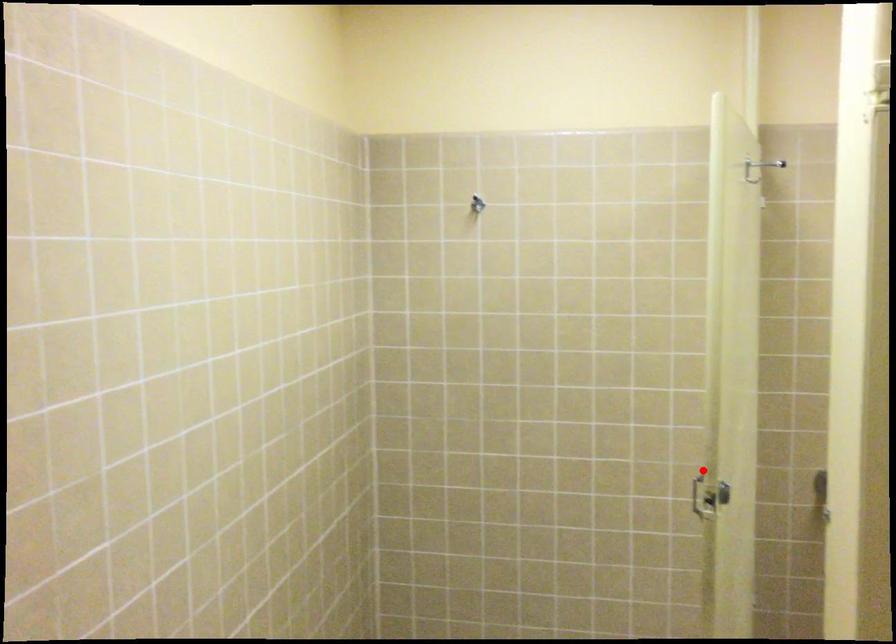
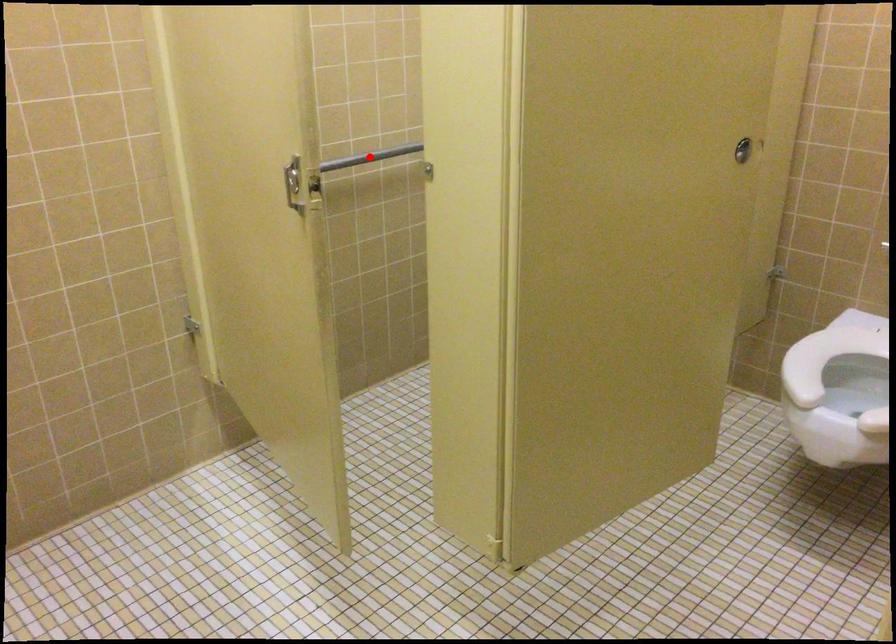
I am providing you with two images of the same scene from different viewpoints. A red point is marked on the first image and another point is marked on the second image. Are the points marked in image1 and image2 representing the same 3D position?

No